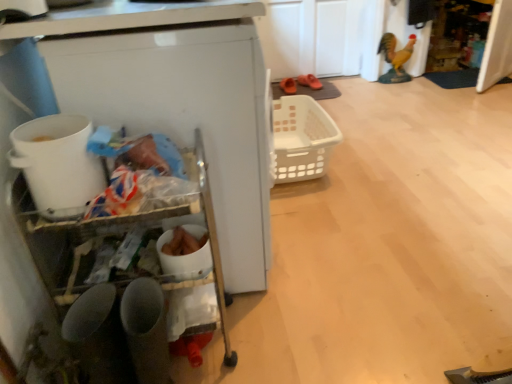
Question: From the image's perspective, does orange rubber clogs at center, which is the first footwear from right to left, appear higher than white plastic basket at center?

Choices:
 (A) no
 (B) yes

Answer: (B)

Question: Considering the relative sizes of orange rubber clogs at center, the 2th footwear positioned from the left, and white plastic basket at center in the image provided, is orange rubber clogs at center, the 2th footwear positioned from the left, smaller than white plastic basket at center?

Choices:
 (A) yes
 (B) no

Answer: (A)

Question: From the image's perspective, is orange rubber clogs at center, which is the first footwear from right to left, under white plastic basket at center?

Choices:
 (A) no
 (B) yes

Answer: (A)

Question: Can you confirm if orange rubber clogs at center, which is the first footwear from right to left, is taller than white plastic basket at center?

Choices:
 (A) no
 (B) yes

Answer: (A)

Question: From a real-world perspective, is orange suede shoes at center, which ranks as the second footwear in right-to-left order, physically located above or below orange rubber clogs at center, which is the first footwear from right to left?

Choices:
 (A) below
 (B) above

Answer: (B)

Question: From their relative heights in the image, would you say orange suede shoes at center, which ranks as the second footwear in right-to-left order, is taller or shorter than orange rubber clogs at center, which is the first footwear from right to left?

Choices:
 (A) tall
 (B) short

Answer: (A)

Question: Do you think orange suede shoes at center, which is counted as the first footwear, starting from the left, is within orange rubber clogs at center, which is the first footwear from right to left, or outside of it?

Choices:
 (A) inside
 (B) outside

Answer: (B)

Question: In terms of width, does orange suede shoes at center, which is counted as the first footwear, starting from the left, look wider or thinner when compared to orange rubber clogs at center, which is the first footwear from right to left?

Choices:
 (A) thin
 (B) wide

Answer: (B)

Question: From the image's perspective, is white plastic basket at center positioned above or below white plastic bucket at left?

Choices:
 (A) above
 (B) below

Answer: (A)

Question: In terms of height, does white plastic basket at center look taller or shorter compared to white plastic bucket at left?

Choices:
 (A) tall
 (B) short

Answer: (A)

Question: In terms of size, does white plastic basket at center appear bigger or smaller than white plastic bucket at left?

Choices:
 (A) big
 (B) small

Answer: (A)

Question: From a real-world perspective, relative to white plastic bucket at left, is white plastic basket at center vertically above or below?

Choices:
 (A) below
 (B) above

Answer: (A)

Question: From their relative heights in the image, would you say shiny gold statue at upper right is taller or shorter than white plastic bucket at left?

Choices:
 (A) short
 (B) tall

Answer: (B)

Question: Is shiny gold statue at upper right bigger or smaller than white plastic bucket at left?

Choices:
 (A) small
 (B) big

Answer: (B)